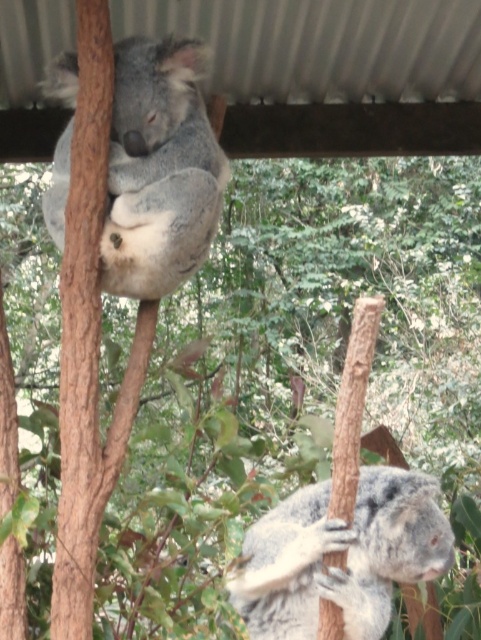
Does gray furry koala at upper center come in front of fuzzy gray koala at lower right?

No, gray furry koala at upper center is behind fuzzy gray koala at lower right.

Who is shorter, gray furry koala at upper center or fuzzy gray koala at lower right?

fuzzy gray koala at lower right

The height and width of the screenshot is (640, 481). Identify the location of gray furry koala at upper center. (160, 170).

At what (x,y) coordinates should I click in order to perform the action: click on gray furry koala at upper center. Please return your answer as a coordinate pair (x, y). This screenshot has width=481, height=640. Looking at the image, I should click on (160, 170).